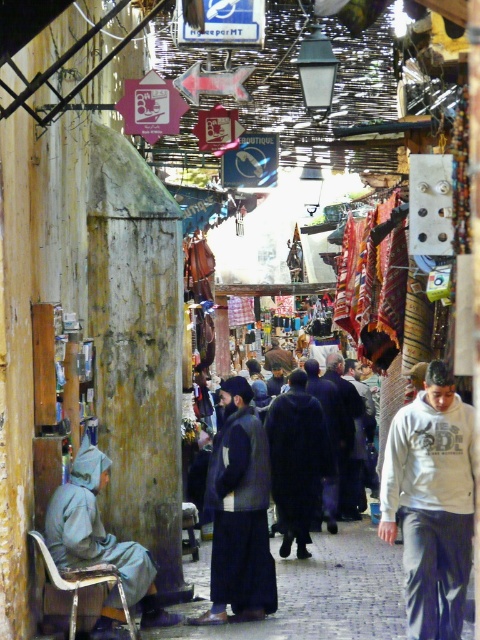
Is dark blue woolen robe at center bigger than gray fabric coat at left?

Yes, dark blue woolen robe at center is bigger than gray fabric coat at left.

Identify the location of dark blue woolen robe at center. The image size is (480, 640). (239, 513).

The width and height of the screenshot is (480, 640). I want to click on white cotton hoodie at center-right, so click(x=432, y=502).

Can you confirm if white cotton hoodie at center-right is shorter than dark blue woolen robe at center?

Yes.

Is point (432, 632) in front of point (250, 532)?

Yes.

The image size is (480, 640). Identify the location of white cotton hoodie at center-right. click(x=432, y=502).

Is white cotton hoodie at center-right wider than dark brown fur coat at center?

No, white cotton hoodie at center-right is not wider than dark brown fur coat at center.

I want to click on white cotton hoodie at center-right, so click(x=432, y=502).